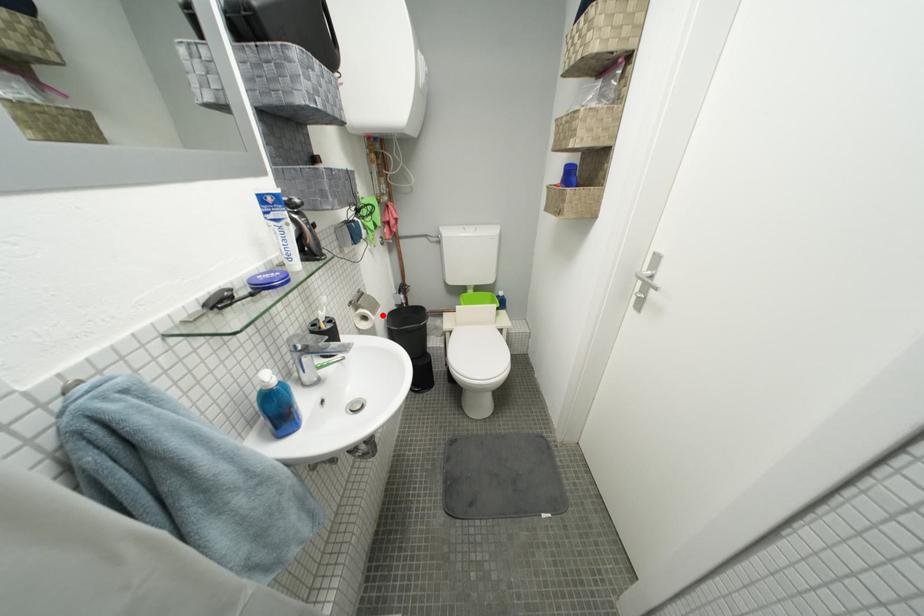
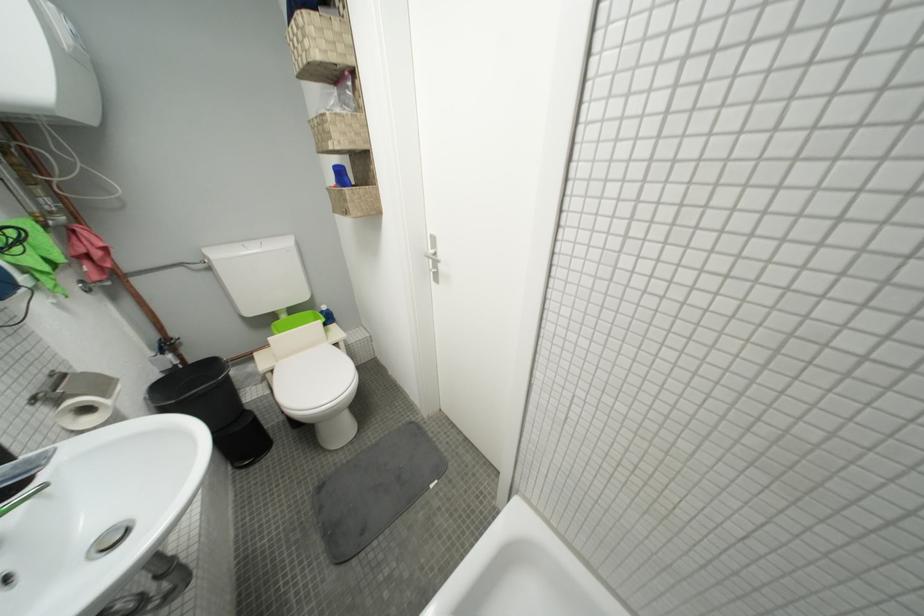
Question: I am providing you with two images of the same scene from different viewpoints. In image1, a red point is highlighted. Considering the same 3D point in image2, which of the following is correct?

Choices:
 (A) It is closer
 (B) It is farther

Answer: (B)